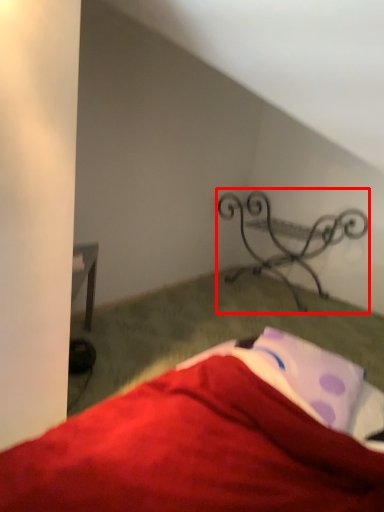
Question: From the image's perspective, what is the correct spatial positioning of furniture (annotated by the red box) in reference to sheet?

Choices:
 (A) below
 (B) above

Answer: (B)